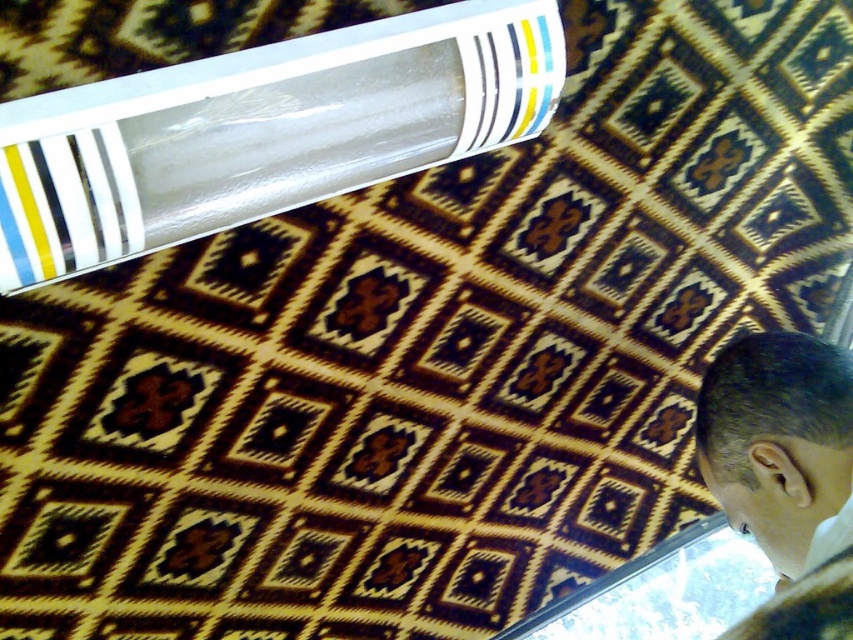
Question: Which of the following is the closest to the observer?

Choices:
 (A) (846, 360)
 (B) (326, 81)

Answer: (B)

Question: Is transparent plastic tube at upper left smaller than dark brown hair at bottom right?

Choices:
 (A) no
 (B) yes

Answer: (A)

Question: Which point appears closest to the camera in this image?

Choices:
 (A) (469, 38)
 (B) (775, 417)

Answer: (B)

Question: Can you confirm if transparent plastic tube at upper left is thinner than dark brown hair at bottom right?

Choices:
 (A) yes
 (B) no

Answer: (B)

Question: Is transparent plastic tube at upper left behind dark brown hair at bottom right?

Choices:
 (A) no
 (B) yes

Answer: (B)